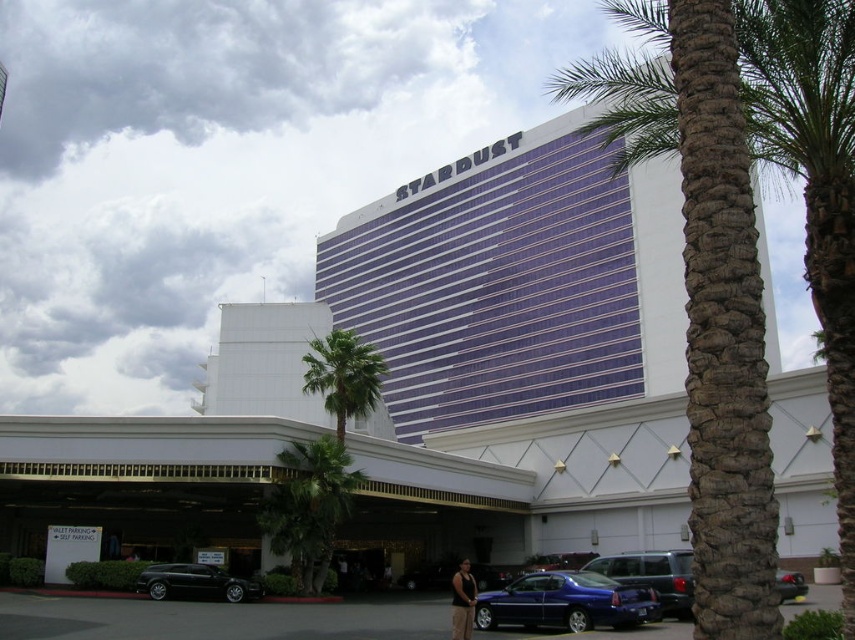
Based on the photo, you are a valet parking attendant at the Stardust hotel and casino. You notice a customer wearing a dark gray tank top at lower center and a shiny black car at lower right. Where is the customer in relation to the car?

The dark gray tank top at lower center is located below the shiny black car at lower right, so the customer is positioned beneath the car.

You are a photographer trying to capture the entire scene of the Stardust hotel and casino. You notice the dark gray tank top at lower center and the shiny black car at lower right in your frame. Which object should you adjust your camera angle to prioritize to ensure both are visible without cropping?

A: The dark gray tank top at lower center is smaller than the shiny black car at lower right, so you should prioritize keeping the shiny black car at lower right in the frame since it takes up more space and is less likely to be cropped out.